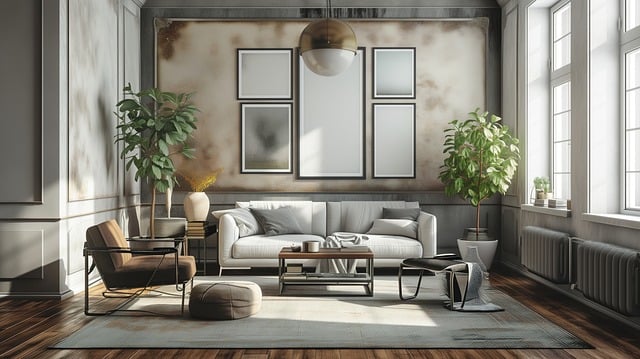
Where is `windows`? The height and width of the screenshot is (359, 640). windows is located at coordinates (560, 140), (634, 119).